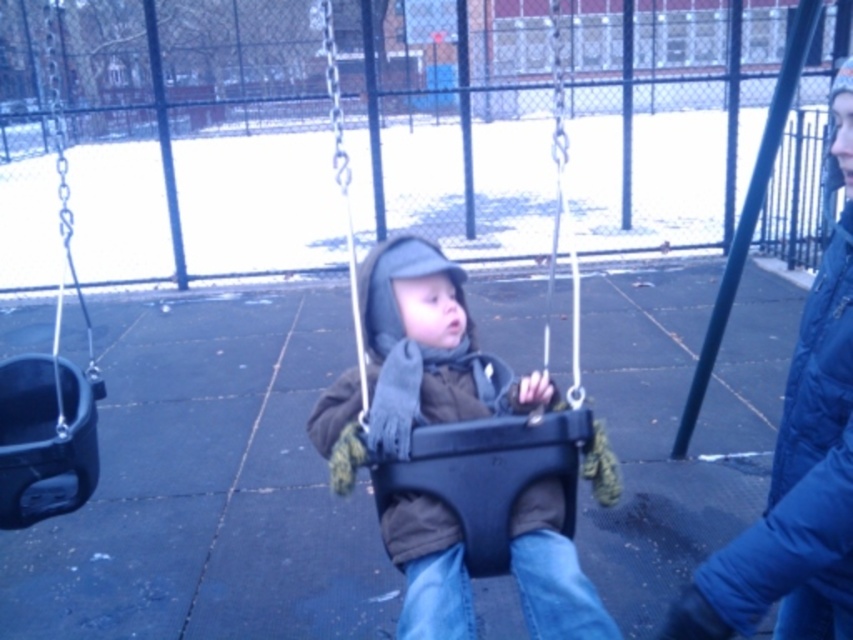
Is blue fleece jacket at center above black plastic swing at center?

Yes.

Between point (751, 552) and point (506, 426), which one is positioned in front?

Point (751, 552)

The height and width of the screenshot is (640, 853). I want to click on blue fleece jacket at center, so click(x=798, y=461).

Does brown matte jacket at center appear on the right side of black plastic swing at left?

Indeed, brown matte jacket at center is positioned on the right side of black plastic swing at left.

The height and width of the screenshot is (640, 853). I want to click on brown matte jacket at center, so click(415, 360).

This screenshot has width=853, height=640. Find the location of `brown matte jacket at center`. brown matte jacket at center is located at coordinates (415, 360).

Which is below, black plastic swing at center or black plastic swing at left?

black plastic swing at center is lower down.

Does black plastic swing at center come behind black plastic swing at left?

No, it is not.

Describe the element at coordinates (489, 474) in the screenshot. I see `black plastic swing at center` at that location.

Identify the location of black plastic swing at center. (489, 474).